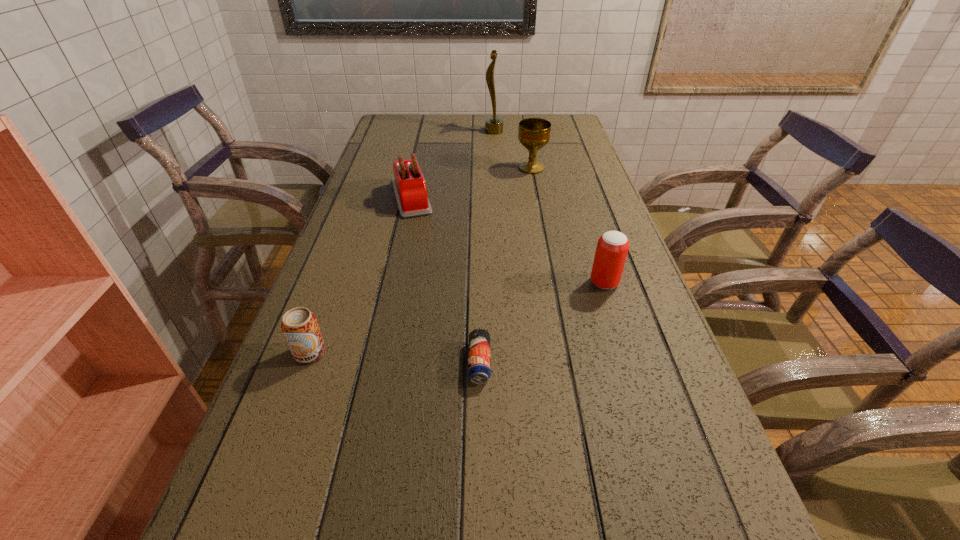
Select which beer can appears as the third closest to the farthest object. Please provide its 2D coordinates. Your answer should be formatted as a tuple, i.e. [(x, y)], where the tuple contains the x and y coordinates of a point satisfying the conditions above.

[(300, 327)]

Locate which beer can is the closest to the toaster. Please provide its 2D coordinates. Your answer should be formatted as a tuple, i.e. [(x, y)], where the tuple contains the x and y coordinates of a point satisfying the conditions above.

[(300, 327)]

The width and height of the screenshot is (960, 540). Identify the location of free region that satisfies the following two spatial constraints: 1. on the front-facing side of the farthest object; 2. on the front side of the toaster. (498, 197).

Find the location of `vacant region that satisfies the following two spatial constraints: 1. on the front-facing side of the farthest object; 2. on the front side of the leftmost beer can`. vacant region that satisfies the following two spatial constraints: 1. on the front-facing side of the farthest object; 2. on the front side of the leftmost beer can is located at coordinates (507, 353).

The height and width of the screenshot is (540, 960). I want to click on free space in the image that satisfies the following two spatial constraints: 1. on the front side of the tallest beer can; 2. on the left side of the second object from left to right, so click(x=393, y=282).

Where is `free space that satisfies the following two spatial constraints: 1. on the front-facing side of the chalice; 2. on the left side of the award`? free space that satisfies the following two spatial constraints: 1. on the front-facing side of the chalice; 2. on the left side of the award is located at coordinates click(496, 168).

The height and width of the screenshot is (540, 960). Identify the location of vacant region that satisfies the following two spatial constraints: 1. on the back side of the fifth object from right to left; 2. on the right side of the second object from right to left. (418, 168).

This screenshot has height=540, width=960. Identify the location of vacant area that satisfies the following two spatial constraints: 1. on the front-facing side of the award; 2. on the front side of the leftmost object. (507, 353).

Locate an element on the screen. This screenshot has height=540, width=960. free point that satisfies the following two spatial constraints: 1. on the back side of the fourth farthest object; 2. on the right side of the shortest object is located at coordinates (479, 282).